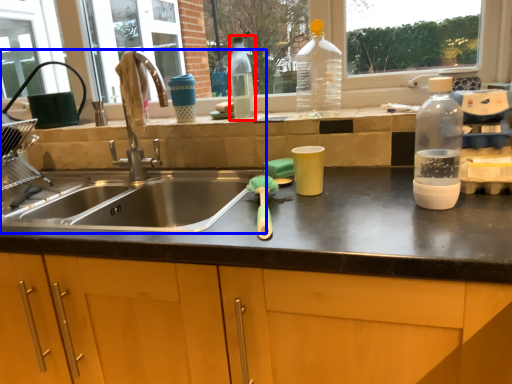
Question: Which point is closer to the camera, bottle (highlighted by a red box) or sink (highlighted by a blue box)?

Choices:
 (A) bottle
 (B) sink

Answer: (B)